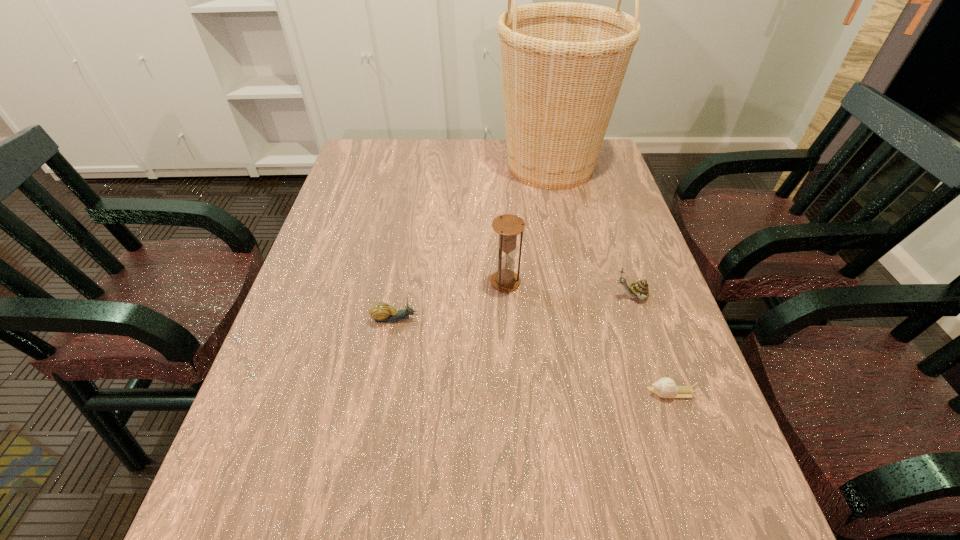
I want to click on unoccupied position between the tallest object and the second tallest object, so click(528, 224).

I want to click on vacant area between the nearest escargot and the third shortest object, so click(651, 345).

Locate an element on the screen. free space between the farthest escargot and the tallest object is located at coordinates (590, 231).

Find the location of a particular element. Image resolution: width=960 pixels, height=540 pixels. unoccupied position between the hourglass and the nearest object is located at coordinates (588, 338).

Identify the location of vacant area that lies between the farthest object and the second tallest object. This screenshot has height=540, width=960. (528, 224).

Locate an element on the screen. The width and height of the screenshot is (960, 540). object that is the second closest one to the tallest object is located at coordinates (639, 289).

Find the location of a particular element. This screenshot has height=540, width=960. object that is the fourth closest to the third shortest object is located at coordinates (381, 312).

At what (x,y) coordinates should I click in order to perform the action: click on the closest escargot to the fourth tallest object. Please return your answer as a coordinate pair (x, y). The height and width of the screenshot is (540, 960). Looking at the image, I should click on (639, 289).

Identify the location of escargot object that ranks as the closest to the nearest escargot. (639, 289).

This screenshot has width=960, height=540. What are the coordinates of `vacant region that satisfies the following two spatial constraints: 1. on the front side of the basket; 2. on the front-facing side of the second farthest escargot` in the screenshot? It's located at (583, 319).